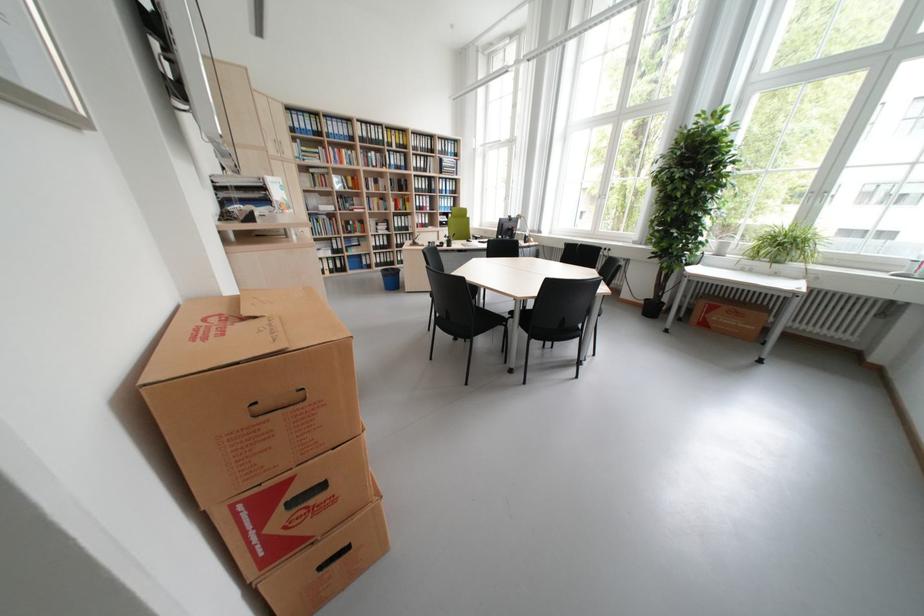
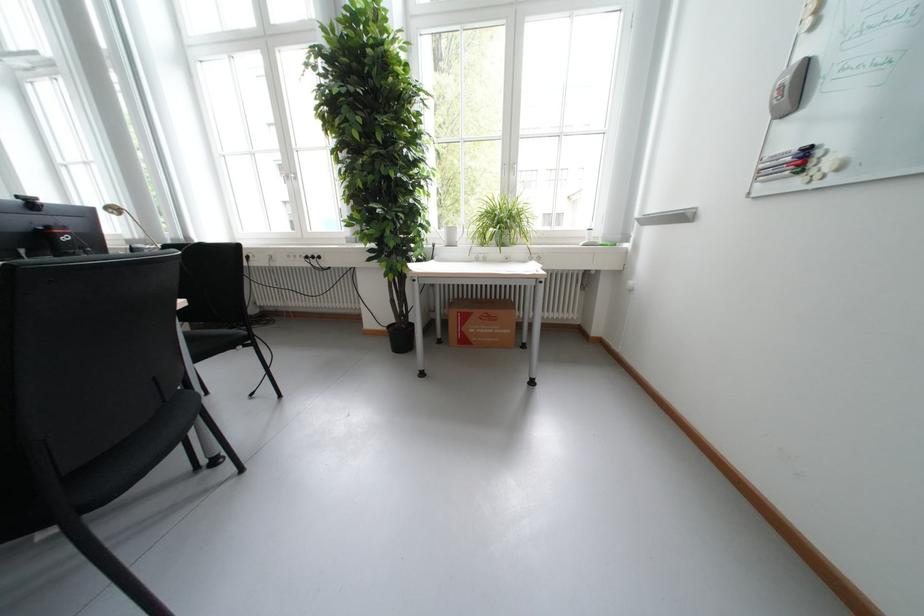
Where in the second image is the point corresponding to (x=734, y=246) from the first image?

(460, 233)